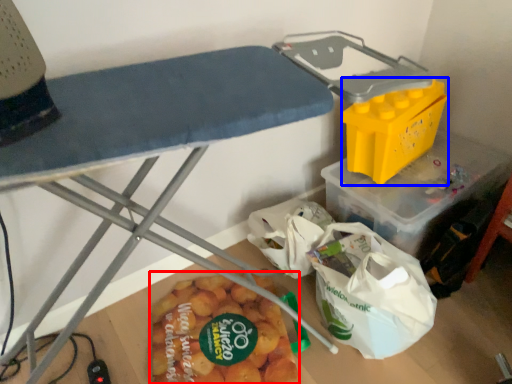
Question: Among these objects, which one is farthest to the camera, food (highlighted by a red box) or box (highlighted by a blue box)?

Choices:
 (A) food
 (B) box

Answer: (B)